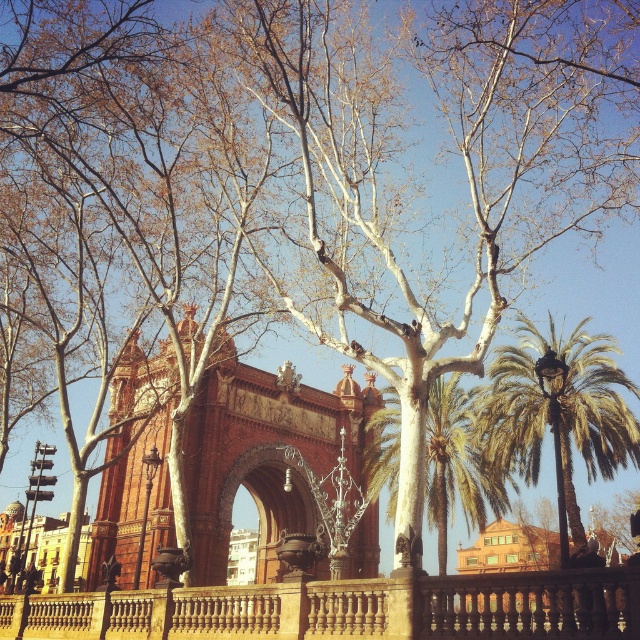
You are standing at the base of the tall, leafless trees with white bark in the foreground of the scene. Looking towards the grand archway, you notice a point marked at coordinates (456, 464). What object does this point correspond to?

The point at (456, 464) corresponds to the green leafy palm tree at center.

Based on the scene description, where is the green leafy palm tree at right located in terms of its 2D coordinates?

The green leafy palm tree at right is located at the 2D coordinates of point (557, 413).